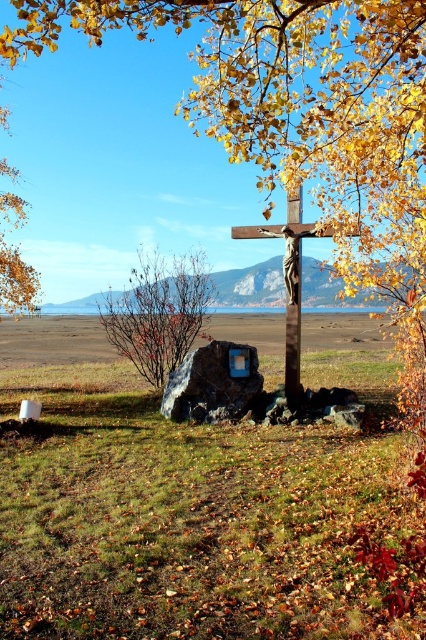
Question: Which object is farther from the camera taking this photo?

Choices:
 (A) rusty metal sign at center
 (B) metallic brown cross at center
 (C) bare branches at center

Answer: (C)

Question: Among these points, which one is nearest to the camera?

Choices:
 (A) (152, 262)
 (B) (291, 346)

Answer: (B)

Question: Is bare branches at center in front of metallic brown cross at center?

Choices:
 (A) yes
 (B) no

Answer: (B)

Question: Is rusty metal sign at center below metallic brown cross at center?

Choices:
 (A) no
 (B) yes

Answer: (B)

Question: Is bare branches at center bigger than metallic brown cross at center?

Choices:
 (A) no
 (B) yes

Answer: (B)

Question: Which point is closer to the camera?

Choices:
 (A) bare branches at center
 (B) metallic brown cross at center

Answer: (B)